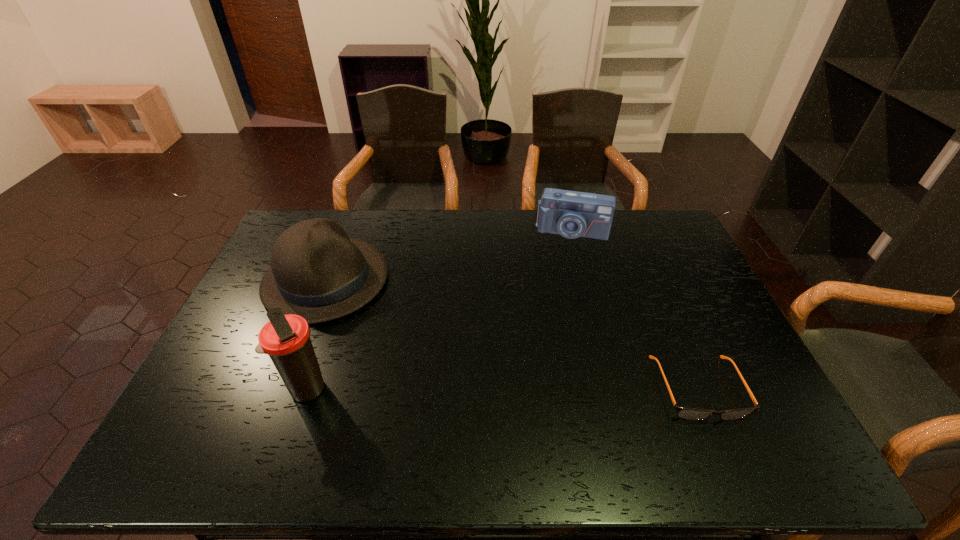
The image size is (960, 540). Identify the location of free space located 0.390m on the front-facing side of the third nearest object. (469, 370).

The height and width of the screenshot is (540, 960). Identify the location of free spot located on the front-facing side of the third nearest object. (446, 356).

In order to click on vacant area situated 0.090m on the front-facing side of the third nearest object in this screenshot , I will do `click(389, 320)`.

This screenshot has width=960, height=540. Find the location of `camera that is at the far edge`. camera that is at the far edge is located at coordinates (572, 214).

The height and width of the screenshot is (540, 960). Identify the location of bowler hat that is at the far edge. (317, 272).

Where is `thermos bottle located in the near edge section of the desktop`? Image resolution: width=960 pixels, height=540 pixels. thermos bottle located in the near edge section of the desktop is located at coordinates (286, 339).

This screenshot has width=960, height=540. Find the location of `spectacles that is positioned at the near edge`. spectacles that is positioned at the near edge is located at coordinates (686, 413).

Where is `object situated at the left edge`? This screenshot has height=540, width=960. object situated at the left edge is located at coordinates (317, 272).

What are the coordinates of `object located in the right edge section of the desktop` in the screenshot? It's located at [686, 413].

Identify the location of object located in the far left corner section of the desktop. (317, 272).